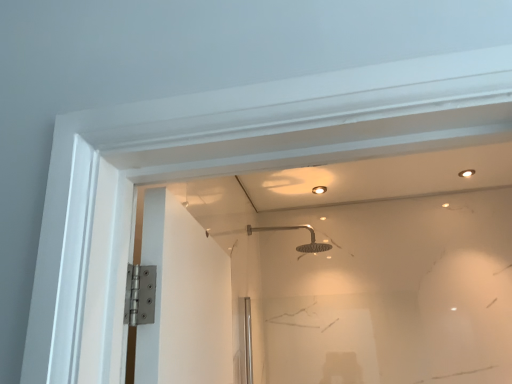
What is the approximate width of silver metallic shower head at center?

silver metallic shower head at center is 47.11 centimeters in width.

This screenshot has height=384, width=512. What do you see at coordinates (300, 245) in the screenshot?
I see `silver metallic shower head at center` at bounding box center [300, 245].

At what (x,y) coordinates should I click in order to perform the action: click on silver metallic shower head at center. Please return your answer as a coordinate pair (x, y). Looking at the image, I should click on (300, 245).

This screenshot has height=384, width=512. I want to click on silver metallic shower head at center, so click(x=300, y=245).